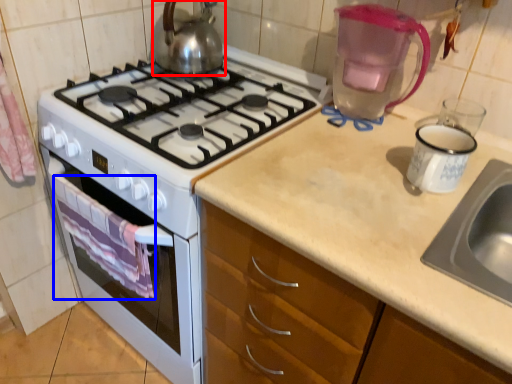
Question: Which point is further to the camera, kettle (highlighted by a red box) or cloth (highlighted by a blue box)?

Choices:
 (A) kettle
 (B) cloth

Answer: (A)